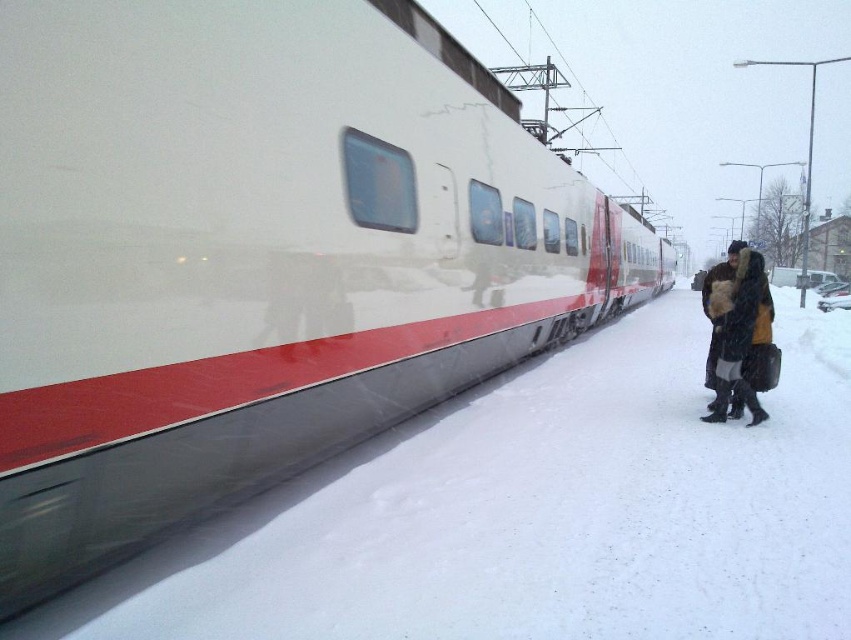
Can you confirm if white powdery snow at lower left is positioned to the left of dark brown fur-trimmed coat at right?

Indeed, white powdery snow at lower left is positioned on the left side of dark brown fur-trimmed coat at right.

Who is positioned more to the left, white powdery snow at lower left or dark brown fur-trimmed coat at right?

white powdery snow at lower left

Where is `white powdery snow at lower left`? white powdery snow at lower left is located at coordinates (535, 513).

Image resolution: width=851 pixels, height=640 pixels. What are the coordinates of `white powdery snow at lower left` in the screenshot? It's located at (535, 513).